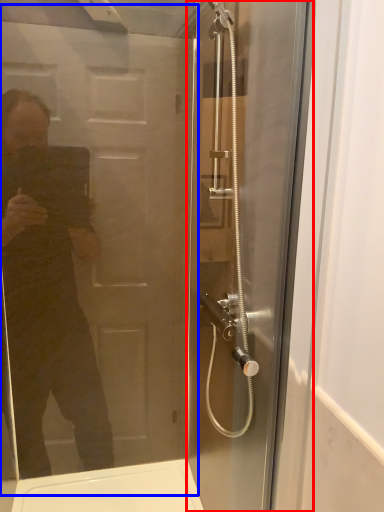
Question: Which object appears closest to the camera in this image, screen door (highlighted by a red box) or screen door (highlighted by a blue box)?

Choices:
 (A) screen door
 (B) screen door

Answer: (B)